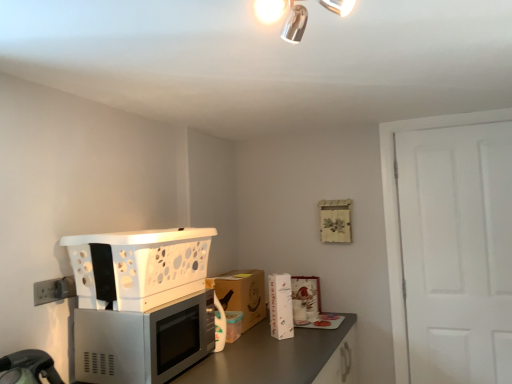
Question: Does metallic chrome light fixture at upper center appear on the left side of metallic gray countertop at lower center?

Choices:
 (A) no
 (B) yes

Answer: (A)

Question: Is metallic chrome light fixture at upper center smaller than metallic gray countertop at lower center?

Choices:
 (A) yes
 (B) no

Answer: (A)

Question: Would you consider metallic chrome light fixture at upper center to be distant from metallic gray countertop at lower center?

Choices:
 (A) no
 (B) yes

Answer: (B)

Question: Can you confirm if metallic chrome light fixture at upper center is bigger than metallic gray countertop at lower center?

Choices:
 (A) no
 (B) yes

Answer: (A)

Question: Can you confirm if metallic chrome light fixture at upper center is taller than metallic gray countertop at lower center?

Choices:
 (A) yes
 (B) no

Answer: (B)

Question: From a real-world perspective, relative to white plastic basket at left, is white plastic electric outlet at lower left vertically above or below?

Choices:
 (A) above
 (B) below

Answer: (B)

Question: From the image's perspective, relative to white plastic basket at left, is white plastic electric outlet at lower left above or below?

Choices:
 (A) below
 (B) above

Answer: (A)

Question: Which is correct: white plastic electric outlet at lower left is inside white plastic basket at left, or outside of it?

Choices:
 (A) inside
 (B) outside

Answer: (B)

Question: Is point (41, 296) closer or farther from the camera than point (101, 236)?

Choices:
 (A) farther
 (B) closer

Answer: (B)

Question: Looking at the image, does white plastic electric outlet at lower left seem bigger or smaller compared to white glossy refrigerator at center, marked as the first appliance in a front-to-back arrangement?

Choices:
 (A) small
 (B) big

Answer: (A)

Question: In the image, is white plastic electric outlet at lower left on the left side or the right side of white glossy refrigerator at center, which ranks as the 1th appliance in left-to-right order?

Choices:
 (A) right
 (B) left

Answer: (B)

Question: In terms of width, does white plastic electric outlet at lower left look wider or thinner when compared to white glossy refrigerator at center, arranged as the second appliance when viewed from the right?

Choices:
 (A) thin
 (B) wide

Answer: (A)

Question: From a real-world perspective, is white plastic electric outlet at lower left physically located above or below white glossy refrigerator at center, arranged as the second appliance when viewed from the right?

Choices:
 (A) above
 (B) below

Answer: (A)

Question: Is metallic chrome light fixture at upper center wider or thinner than white plastic basket at left?

Choices:
 (A) thin
 (B) wide

Answer: (A)

Question: Relative to white plastic basket at left, is metallic chrome light fixture at upper center in front or behind?

Choices:
 (A) behind
 (B) front

Answer: (B)